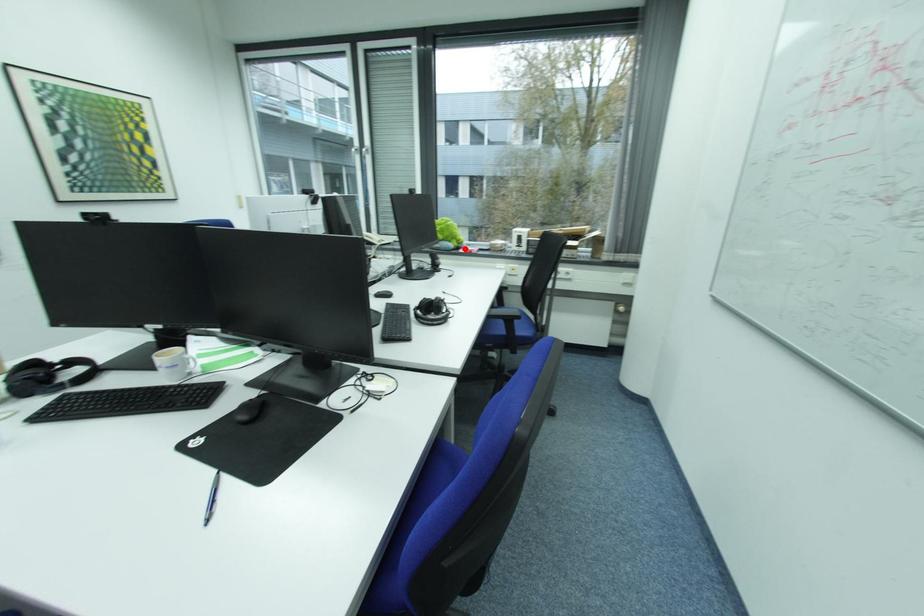
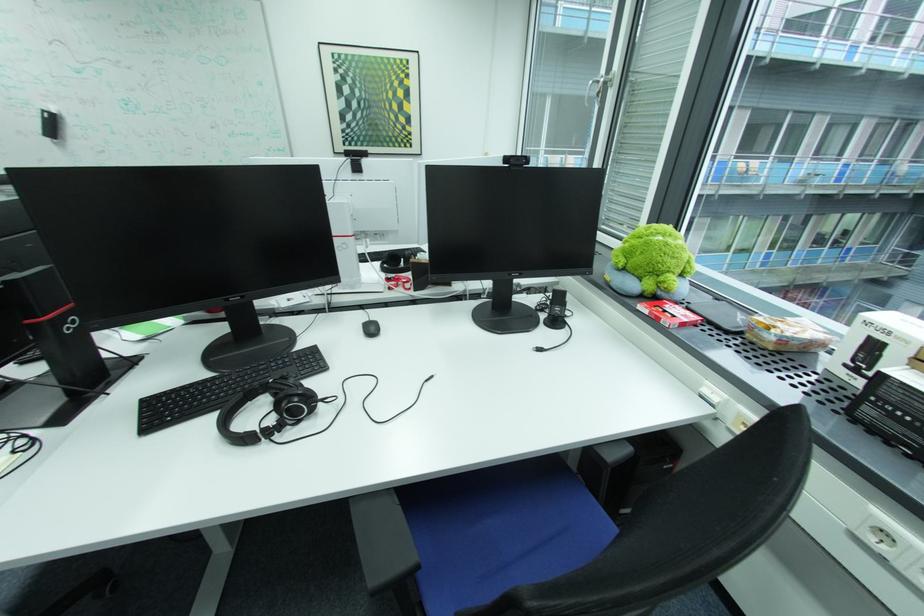
In the second image, find the point that corresponds to the highlighted location in the first image.

(659, 297)